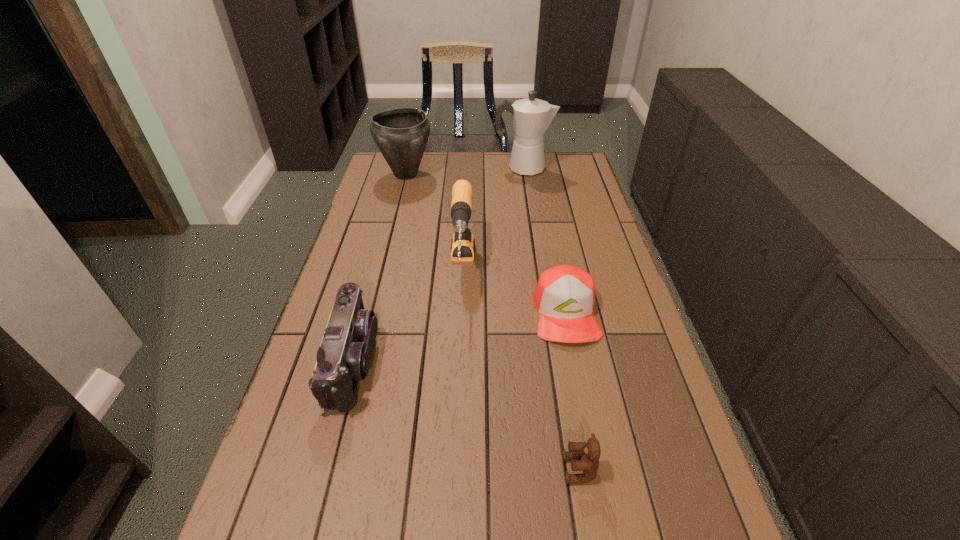
Where is `unoccupied area between the tallest object and the urn`? Image resolution: width=960 pixels, height=540 pixels. unoccupied area between the tallest object and the urn is located at coordinates point(465,171).

The height and width of the screenshot is (540, 960). What are the coordinates of `vacant space that's between the third shortest object and the urn` in the screenshot? It's located at (379, 268).

In order to click on free space between the third shortest object and the teddy bear in this screenshot , I will do `click(467, 415)`.

Identify the location of vacant space that's between the urn and the baseball cap. (486, 244).

You are a GUI agent. You are given a task and a screenshot of the screen. Output one action in this format:
    pyautogui.click(x=<x>, y=<y>)
    Task: Click on the vacant space in between the coffeepot and the third shortest object
    This screenshot has height=540, width=960.
    Given the screenshot: What is the action you would take?
    pyautogui.click(x=438, y=265)

Locate which object is the second closest to the nearest object. Please provide its 2D coordinates. Your answer should be formatted as a tuple, i.e. [(x, y)], where the tuple contains the x and y coordinates of a point satisfying the conditions above.

[(345, 352)]

Locate which object ranks second in proximity to the third object from left to right. Please provide its 2D coordinates. Your answer should be formatted as a tuple, i.e. [(x, y)], where the tuple contains the x and y coordinates of a point satisfying the conditions above.

[(345, 352)]

The height and width of the screenshot is (540, 960). In order to click on vacant space that satisfies the following two spatial constraints: 1. on the handle side of the drill; 2. on the front-facing side of the third shortest object in this screenshot , I will do `click(458, 362)`.

You are a GUI agent. You are given a task and a screenshot of the screen. Output one action in this format:
    pyautogui.click(x=<x>, y=<y>)
    Task: Click on the free location that satisfies the following two spatial constraints: 1. on the front-facing side of the baseball cap; 2. on the face of the nearest object
    
    Given the screenshot: What is the action you would take?
    pyautogui.click(x=596, y=469)